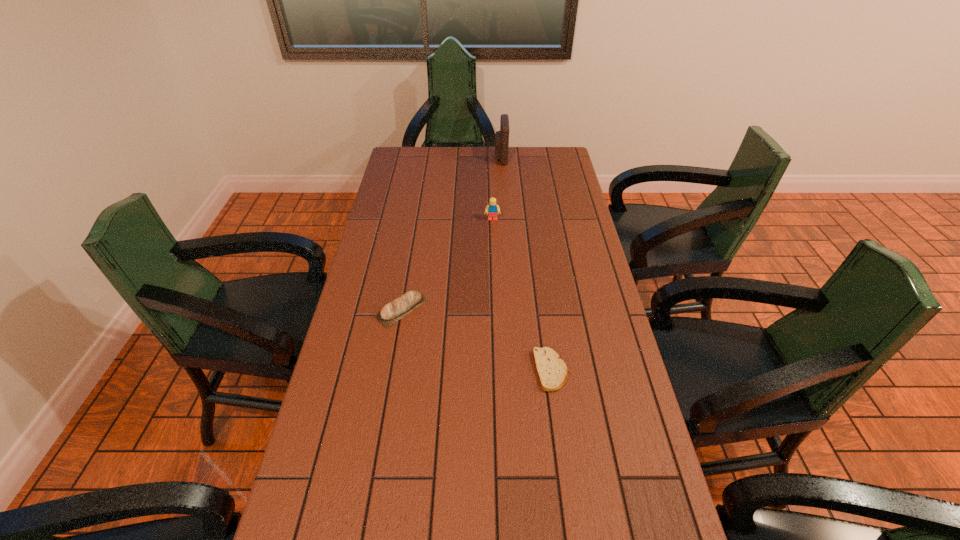
The width and height of the screenshot is (960, 540). I want to click on vacant space at the far left corner, so click(413, 163).

The image size is (960, 540). Identify the location of free space between the Lego and the pouch. (496, 188).

You are a GUI agent. You are given a task and a screenshot of the screen. Output one action in this format:
    pyautogui.click(x=<x>, y=<y>)
    Task: Click on the blank region between the nearer pita bread and the farthest object
    
    Given the screenshot: What is the action you would take?
    pyautogui.click(x=526, y=264)

You are a GUI agent. You are given a task and a screenshot of the screen. Output one action in this format:
    pyautogui.click(x=<x>, y=<y>)
    Task: Click on the unoccupied position between the farthest object and the third tallest object
    The image size is (960, 540).
    Given the screenshot: What is the action you would take?
    pyautogui.click(x=451, y=233)

Locate an element on the screen. The height and width of the screenshot is (540, 960). vacant space that is in between the rightmost object and the taller pita bread is located at coordinates (476, 339).

Where is `vacant space that's between the leftmost object and the nearer pita bread`? The width and height of the screenshot is (960, 540). vacant space that's between the leftmost object and the nearer pita bread is located at coordinates (476, 339).

You are a GUI agent. You are given a task and a screenshot of the screen. Output one action in this format:
    pyautogui.click(x=<x>, y=<y>)
    Task: Click on the free space between the second farthest object and the pouch
    This screenshot has width=960, height=540.
    Given the screenshot: What is the action you would take?
    pyautogui.click(x=496, y=188)

Image resolution: width=960 pixels, height=540 pixels. In order to click on vacant area that lies between the second tallest object and the leftmost object in this screenshot , I will do `click(447, 264)`.

This screenshot has width=960, height=540. I want to click on vacant area that lies between the second nearest object and the Lego, so click(447, 264).

What are the coordinates of `free spot between the second tallest object and the shortest object` in the screenshot? It's located at (521, 295).